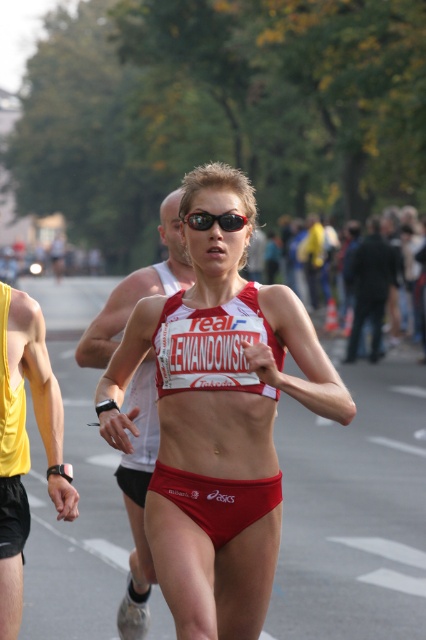
Question: Which object is positioned farthest from the yellow fabric tank top at left?

Choices:
 (A) red matte bikini top at center
 (B) black plastic sunglasses at center
 (C) red matte underwear at center
 (D) black fabric jacket at upper center

Answer: (D)

Question: Is matte red bikini at center positioned before white mesh tank top at center?

Choices:
 (A) yes
 (B) no

Answer: (A)

Question: Does red matte bikini top at center appear under black plastic sunglasses at center?

Choices:
 (A) yes
 (B) no

Answer: (A)

Question: Which point is farther to the camera?

Choices:
 (A) black plastic sunglasses at center
 (B) yellow fabric tank top at left
 (C) red matte bikini top at center

Answer: (A)

Question: From the image, what is the correct spatial relationship of matte red bikini at center in relation to white mesh tank top at center?

Choices:
 (A) below
 (B) above

Answer: (B)

Question: Among these objects, which one is nearest to the camera?

Choices:
 (A) black fabric jacket at upper center
 (B) red matte bikini top at center
 (C) black plastic sunglasses at center
 (D) matte red bikini at center

Answer: (D)